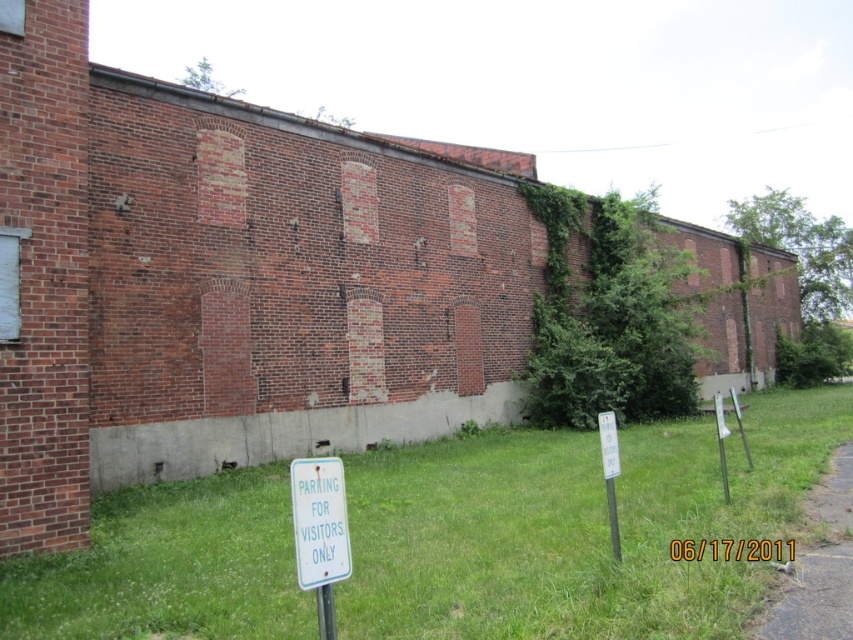
Looking at this image, you are standing at point (300, 480) and want to walk to point (718, 614). Based on the scene description, can you see the destination point from your current position?

Point (718, 614) is behind point (300, 480), so you cannot see the destination point from your current position.

You are standing in front of the brick building and notice gravel at lower right and a white plastic sign at lower center. Which object is closer to you?

The white plastic sign at lower center is closer to you because it is at lower center, while the gravel at lower right is further away.

You are a visitor looking for a parking spot. You see the green grass at lower center and the gravel at lower right. Which area is more likely to be a designated parking area?

The gravel at lower right is more likely to be a designated parking area since the green grass at lower center is to the left of it, and parking areas are typically paved or gravel, not grassy.